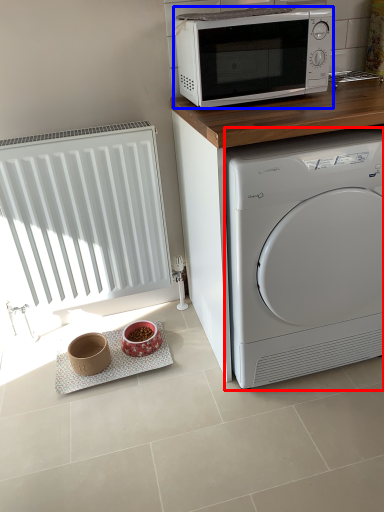
Question: Which object is closer to the camera taking this photo, washing machine (highlighted by a red box) or microwave oven (highlighted by a blue box)?

Choices:
 (A) washing machine
 (B) microwave oven

Answer: (A)